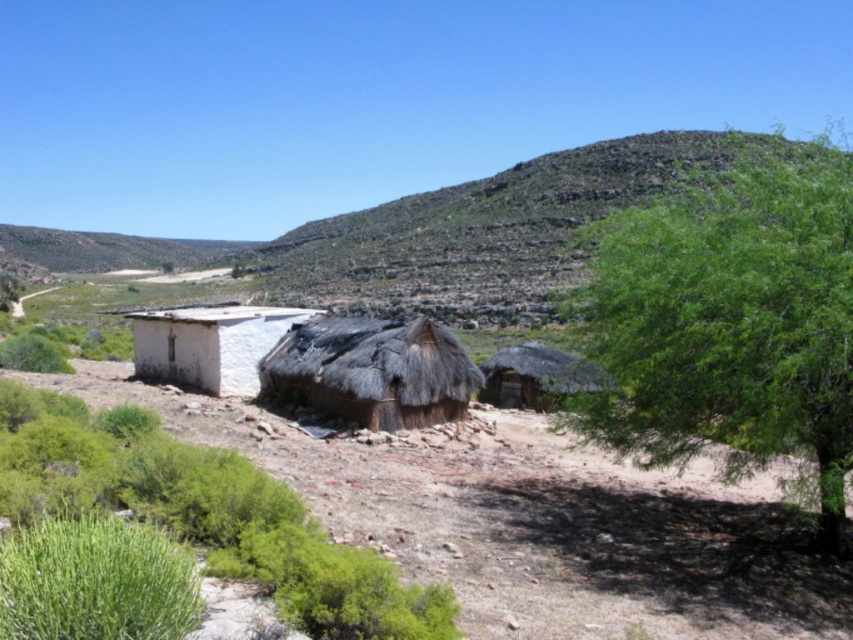
Who is more distant from viewer, (347, 561) or (245, 328)?

The point (245, 328) is more distant.

Is point (316, 568) less distant than point (300, 314)?

Yes, point (316, 568) is in front of point (300, 314).

Who is more forward, (440,609) or (213,364)?

Positioned in front is point (440,609).

You are a GUI agent. You are given a task and a screenshot of the screen. Output one action in this format:
    pyautogui.click(x=<x>, y=<y>)
    Task: Click on the green leafy shrubs at lower left
    This screenshot has width=853, height=640.
    Given the screenshot: What is the action you would take?
    pyautogui.click(x=207, y=513)

Who is lower down, green leafy tree at right or green leafy shrubs at lower left?

Positioned lower is green leafy shrubs at lower left.

Identify the location of green leafy tree at right. The height and width of the screenshot is (640, 853). (730, 321).

Between point (712, 369) and point (210, 472), which one is positioned in front?

Point (210, 472)

Where is `green leafy tree at right`? green leafy tree at right is located at coordinates (730, 321).

In the scene shown: Does white thatch hut at left have a lesser width compared to thatched brown hut at center?

Incorrect, white thatch hut at left's width is not less than thatched brown hut at center's.

Is point (218, 326) behind point (483, 364)?

No, it is in front of (483, 364).

Is point (141, 349) closer to camera compared to point (480, 401)?

No, (141, 349) is further to viewer.

Find the location of a particular element. The height and width of the screenshot is (640, 853). white thatch hut at left is located at coordinates (209, 344).